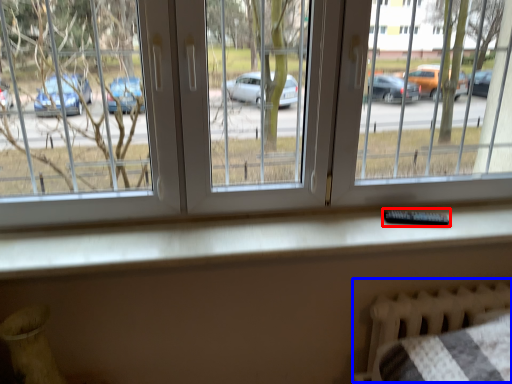
Question: Which object appears closest to the camera in this image, remote (highlighted by a red box) or bed frame (highlighted by a blue box)?

Choices:
 (A) remote
 (B) bed frame

Answer: (A)